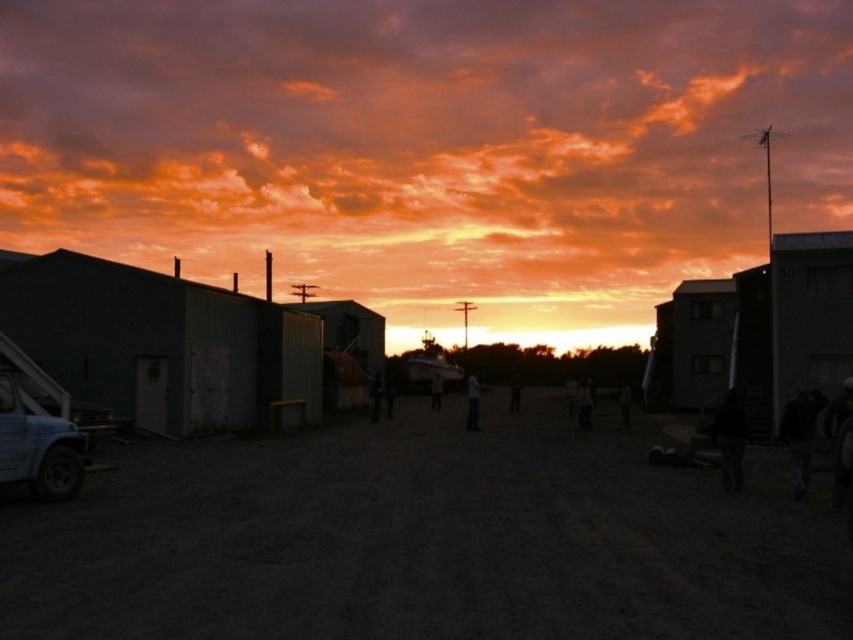
You are a delivery person trying to decide whether to leave a package in the shade. You see the smooth concrete hut at right and the dark gray fabric jacket at lower right. Which object can provide more shade coverage for the package?

The smooth concrete hut at right is bigger than the dark gray fabric jacket at lower right, so it can provide more shade coverage for the package.